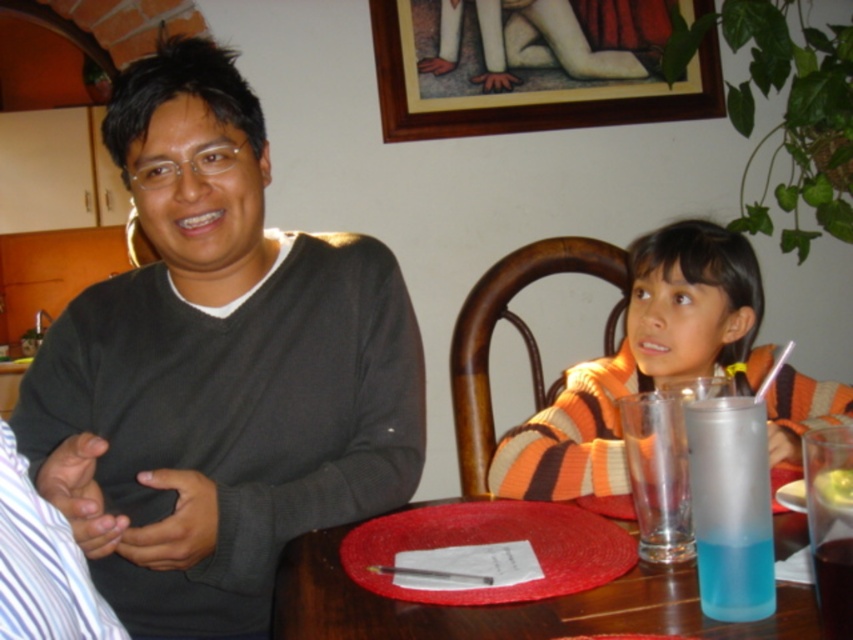
Is smooth wooden table at center thinner than blue translucent cup at table center?

No, smooth wooden table at center is not thinner than blue translucent cup at table center.

Describe the element at coordinates (509, 605) in the screenshot. I see `smooth wooden table at center` at that location.

Is point (598, 602) behind point (840, 554)?

Yes.

Locate an element on the screen. smooth wooden table at center is located at coordinates (509, 605).

Is dark gray sweater at left bigger than smooth wooden table at center?

Yes, dark gray sweater at left is bigger than smooth wooden table at center.

Does dark gray sweater at left have a greater width compared to smooth wooden table at center?

No.

The width and height of the screenshot is (853, 640). Describe the element at coordinates (218, 369) in the screenshot. I see `dark gray sweater at left` at that location.

Find the location of a particular element. The height and width of the screenshot is (640, 853). dark gray sweater at left is located at coordinates (218, 369).

Is the position of striped sweater at center more distant than that of yellow creamy food at center?

Yes, it is behind yellow creamy food at center.

In the scene shown: Is striped sweater at center smaller than yellow creamy food at center?

No, striped sweater at center is not smaller than yellow creamy food at center.

This screenshot has height=640, width=853. Describe the element at coordinates (641, 364) in the screenshot. I see `striped sweater at center` at that location.

Find the location of a particular element. This screenshot has width=853, height=640. striped sweater at center is located at coordinates (641, 364).